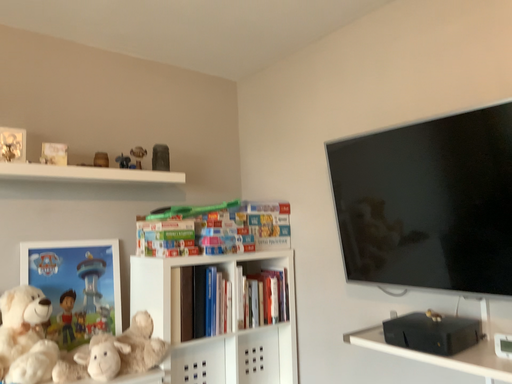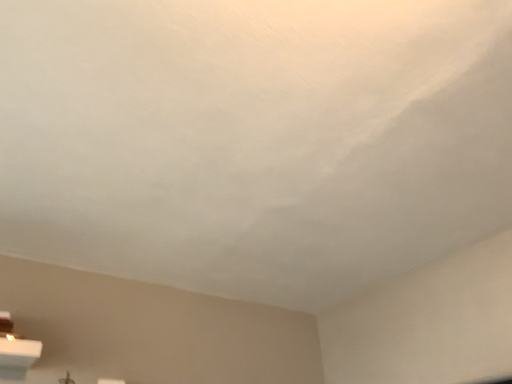
Question: Which way did the camera rotate in the video?

Choices:
 (A) rotated downward
 (B) rotated upward

Answer: (B)